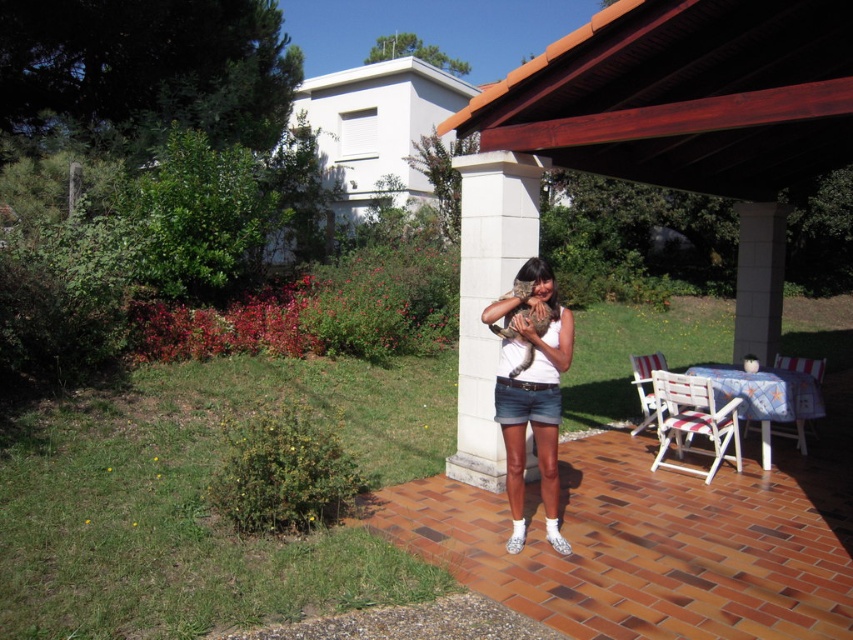
Is brown wood canopy at upper center positioned in front of plaid fabric chair at lower right?

Yes, brown wood canopy at upper center is in front of plaid fabric chair at lower right.

Is point (741, 42) behind point (811, 372)?

No, (741, 42) is in front of (811, 372).

Is point (572, 106) positioned after point (804, 426)?

No, it is in front of (804, 426).

Identify the location of brown wood canopy at upper center. tap(683, 96).

Does white concrete pillar at center have a lesser width compared to plaid fabric chair at lower right?

No, white concrete pillar at center is not thinner than plaid fabric chair at lower right.

Who is positioned more to the right, white concrete pillar at center or plaid fabric chair at lower right?

Positioned to the right is plaid fabric chair at lower right.

Locate an element on the screen. This screenshot has width=853, height=640. white concrete pillar at center is located at coordinates (488, 296).

Where is `white concrete pillar at center`? white concrete pillar at center is located at coordinates (488, 296).

Between white cotton shirt at center and plaid fabric chair at lower right, which one is positioned lower?

plaid fabric chair at lower right

Who is positioned more to the right, white cotton shirt at center or plaid fabric chair at lower right?

plaid fabric chair at lower right is more to the right.

Does point (532, 385) lie in front of point (781, 356)?

Yes.

This screenshot has height=640, width=853. I want to click on white cotton shirt at center, so click(531, 390).